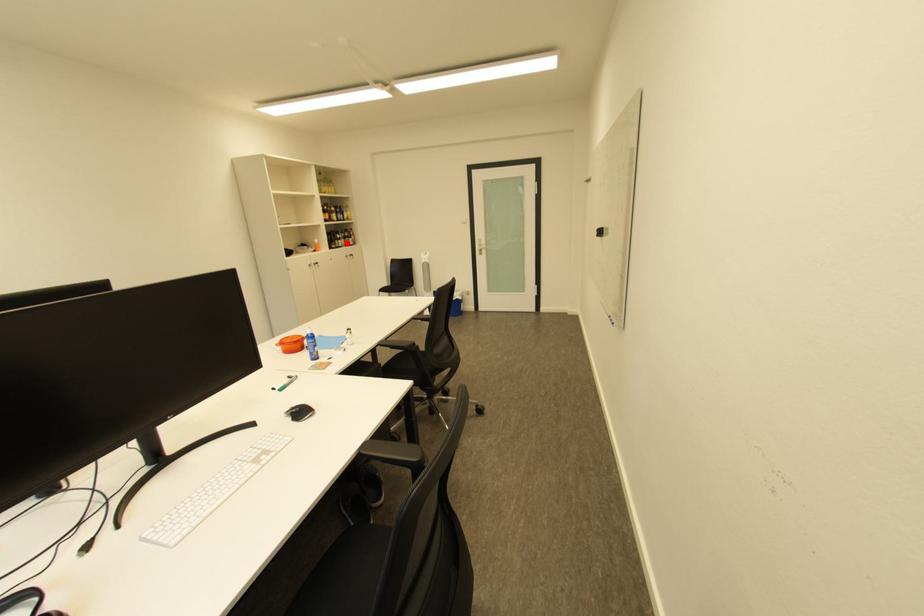
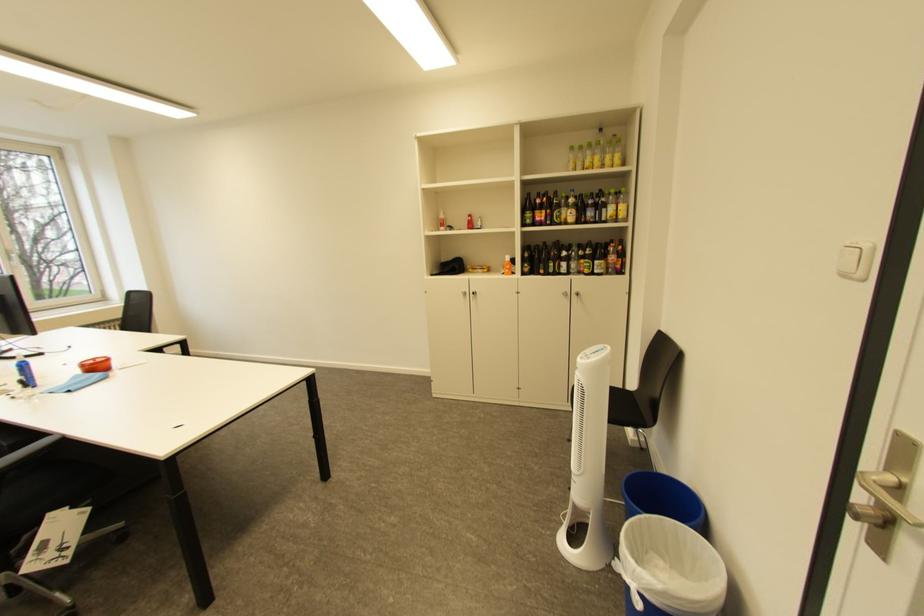
In the second image, find the point that corresponds to the highlighted location in the first image.

(562, 265)